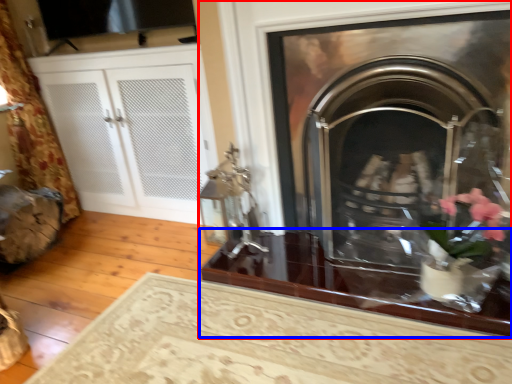
Question: Among these objects, which one is nearest to the camera, fireplace (highlighted by a red box) or table (highlighted by a blue box)?

Choices:
 (A) fireplace
 (B) table

Answer: (A)